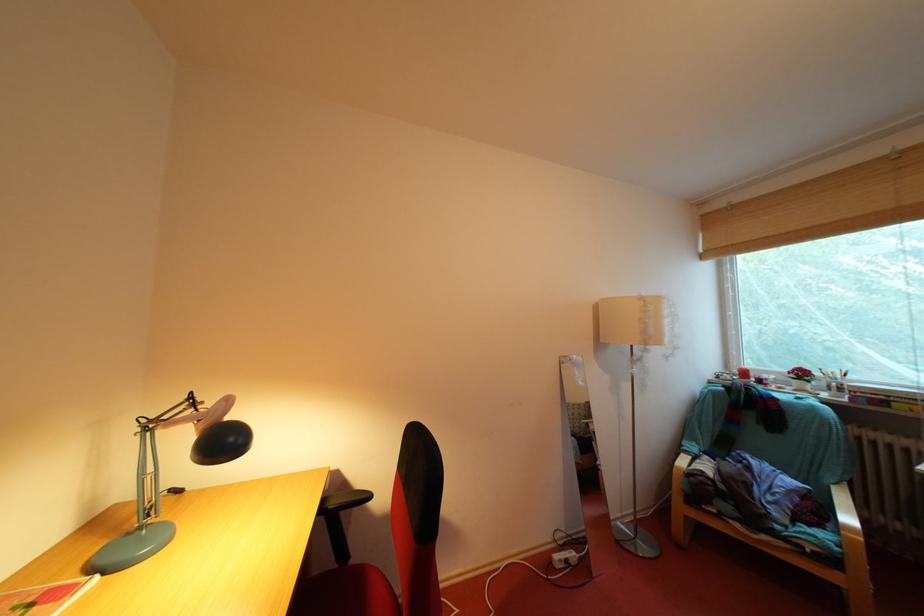
What do you see at coordinates (343, 500) in the screenshot? This screenshot has width=924, height=616. I see `the black chair armrest` at bounding box center [343, 500].